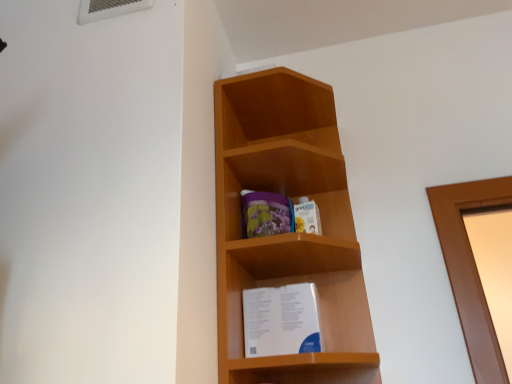
Question: Is white paper at center shorter than light brown wood at center?

Choices:
 (A) yes
 (B) no

Answer: (A)

Question: Is white paper at center thinner than light brown wood at center?

Choices:
 (A) yes
 (B) no

Answer: (A)

Question: From a real-world perspective, is white paper at center beneath light brown wood at center?

Choices:
 (A) no
 (B) yes

Answer: (B)

Question: Does white paper at center come behind light brown wood at center?

Choices:
 (A) yes
 (B) no

Answer: (A)

Question: Is white paper at center completely or partially outside of light brown wood at center?

Choices:
 (A) yes
 (B) no

Answer: (B)

Question: Considering the relative sizes of white paper at center and light brown wood at center in the image provided, is white paper at center bigger than light brown wood at center?

Choices:
 (A) yes
 (B) no

Answer: (B)

Question: Is light brown wood at center smaller than white paper at center?

Choices:
 (A) yes
 (B) no

Answer: (B)

Question: Does light brown wood at center have a larger size compared to white paper at center?

Choices:
 (A) no
 (B) yes

Answer: (B)

Question: From a real-world perspective, is light brown wood at center positioned over white paper at center based on gravity?

Choices:
 (A) yes
 (B) no

Answer: (A)

Question: Is light brown wood at center at the left side of white paper at center?

Choices:
 (A) no
 (B) yes

Answer: (B)

Question: From the image's perspective, is light brown wood at center under white paper at center?

Choices:
 (A) no
 (B) yes

Answer: (A)

Question: Does light brown wood at center contain white paper at center?

Choices:
 (A) no
 (B) yes

Answer: (B)

Question: Is white paper at center bigger or smaller than light brown wood at center?

Choices:
 (A) small
 (B) big

Answer: (A)